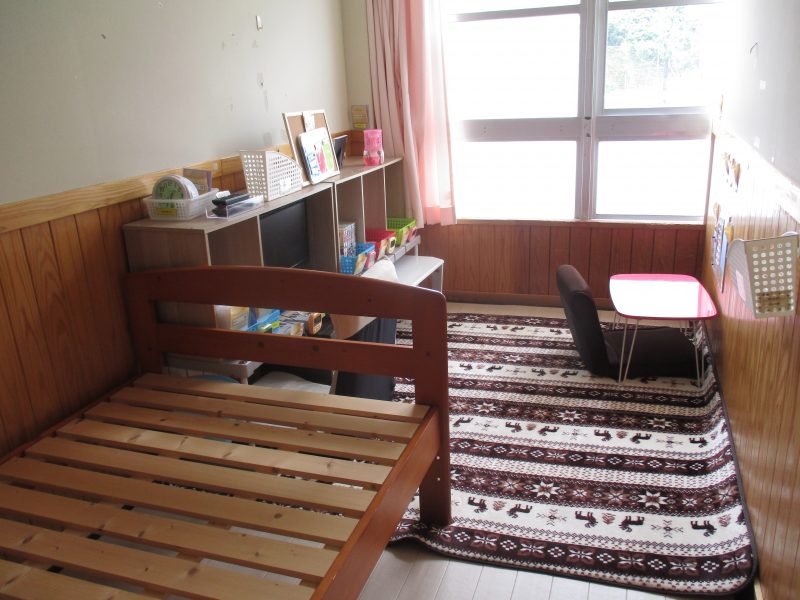
At what (x,y) coordinates should I click in order to perform the action: click on table. Please return your answer as a coordinate pair (x, y). Looking at the image, I should click on (658, 301).